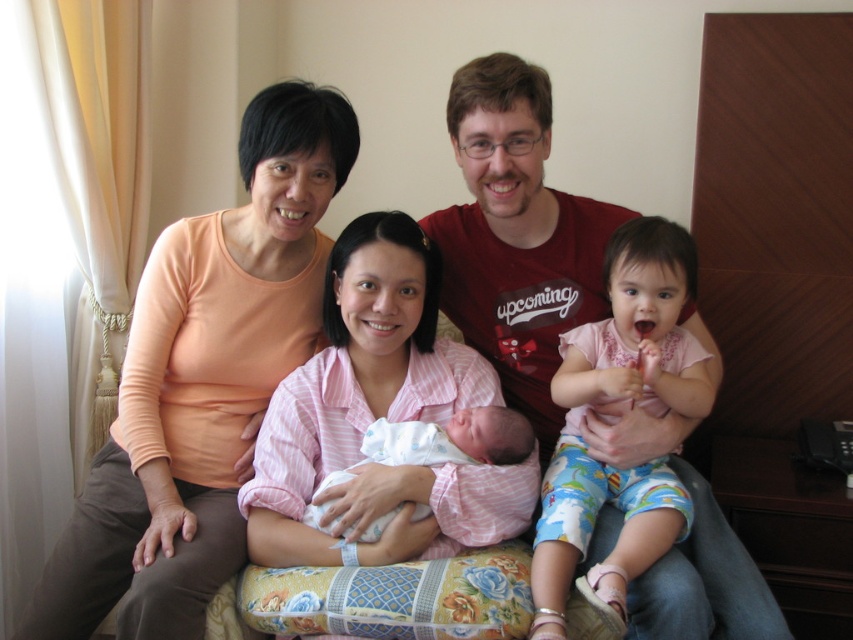
The width and height of the screenshot is (853, 640). Identify the location of matte peach shirt at left. (202, 381).

From the picture: Does matte peach shirt at left come behind matte red shirt at center?

That is False.

Which is in front, point (218, 387) or point (606, 308)?

Point (218, 387) is in front.

Locate an element on the screen. This screenshot has width=853, height=640. matte peach shirt at left is located at coordinates (202, 381).

Is matte peach shirt at left thinner than white cotton swaddle at center?

In fact, matte peach shirt at left might be wider than white cotton swaddle at center.

Is point (155, 244) in front of point (527, 508)?

No, (155, 244) is behind (527, 508).

Identify the location of matte peach shirt at left. The width and height of the screenshot is (853, 640). (202, 381).

Is matte red shirt at center to the left of light pink fabric baby at center from the viewer's perspective?

Yes, matte red shirt at center is to the left of light pink fabric baby at center.

What do you see at coordinates (517, 236) in the screenshot?
I see `matte red shirt at center` at bounding box center [517, 236].

Does point (517, 173) come farther from viewer compared to point (543, 579)?

Yes, point (517, 173) is farther from viewer.

Where is `matte red shirt at center`? matte red shirt at center is located at coordinates (x=517, y=236).